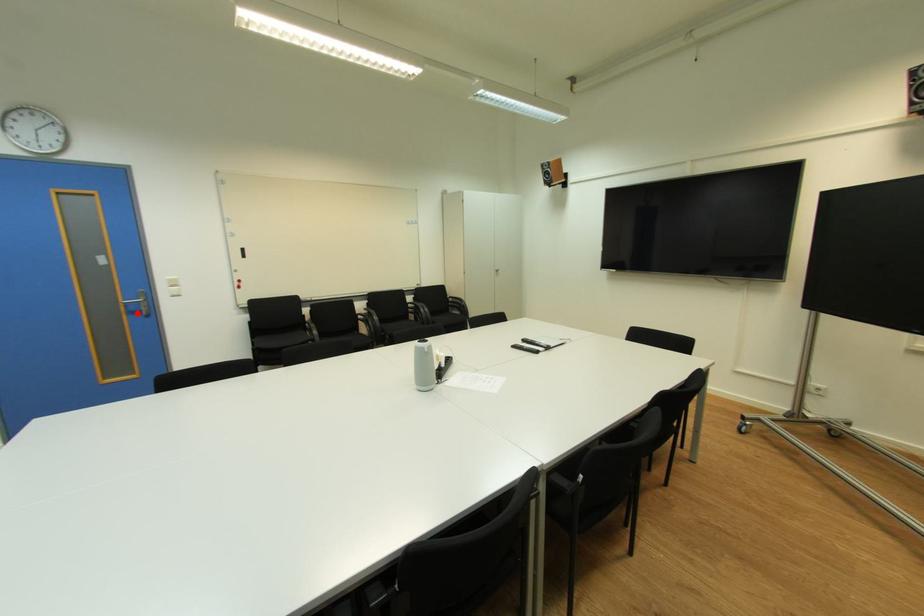
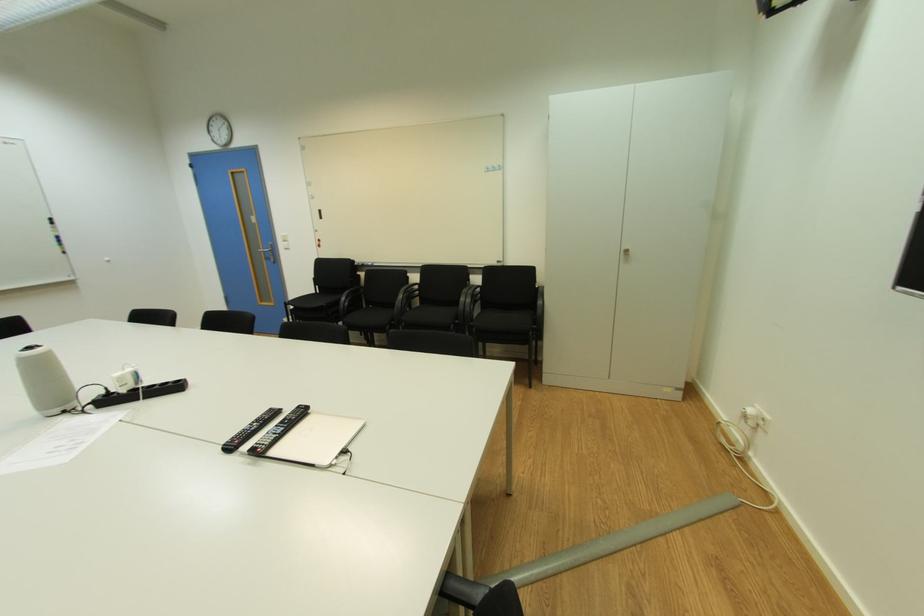
Question: A red point is marked in image1. In image2, is the corresponding 3D point closer to the camera or farther? Reply with the corresponding letter.

Choices:
 (A) The corresponding 3D point is closer.
 (B) The corresponding 3D point is farther.

Answer: (A)